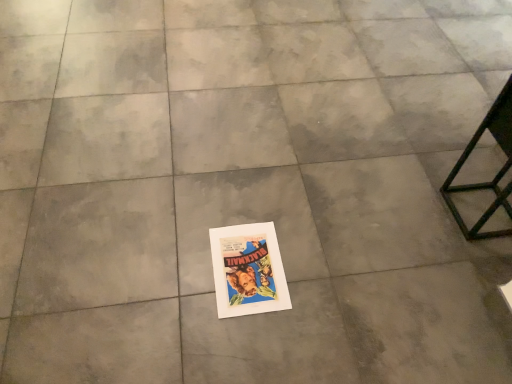
Question: Should I look upward or downward to see metallic black table at right?

Choices:
 (A) up
 (B) down

Answer: (A)

Question: Is metallic black table at right at the left side of vibrant paper poster at center?

Choices:
 (A) yes
 (B) no

Answer: (B)

Question: From a real-world perspective, is metallic black table at right under vibrant paper poster at center?

Choices:
 (A) no
 (B) yes

Answer: (A)

Question: Considering the relative sizes of metallic black table at right and vibrant paper poster at center in the image provided, is metallic black table at right shorter than vibrant paper poster at center?

Choices:
 (A) no
 (B) yes

Answer: (A)

Question: Is metallic black table at right bigger than vibrant paper poster at center?

Choices:
 (A) no
 (B) yes

Answer: (B)

Question: Is the depth of metallic black table at right less than that of vibrant paper poster at center?

Choices:
 (A) yes
 (B) no

Answer: (A)

Question: From the image's perspective, is metallic black table at right above vibrant paper poster at center?

Choices:
 (A) yes
 (B) no

Answer: (A)

Question: Is the depth of vibrant paper poster at center less than that of metallic black table at right?

Choices:
 (A) no
 (B) yes

Answer: (A)

Question: Does vibrant paper poster at center turn towards metallic black table at right?

Choices:
 (A) yes
 (B) no

Answer: (B)

Question: Is metallic black table at right surrounded by vibrant paper poster at center?

Choices:
 (A) no
 (B) yes

Answer: (A)

Question: Is vibrant paper poster at center turned away from metallic black table at right?

Choices:
 (A) no
 (B) yes

Answer: (A)

Question: From a real-world perspective, is vibrant paper poster at center under metallic black table at right?

Choices:
 (A) yes
 (B) no

Answer: (A)

Question: From the image's perspective, does vibrant paper poster at center appear lower than metallic black table at right?

Choices:
 (A) yes
 (B) no

Answer: (A)

Question: Considering the relative positions of vibrant paper poster at center and metallic black table at right in the image provided, is vibrant paper poster at center to the left or to the right of metallic black table at right?

Choices:
 (A) left
 (B) right

Answer: (A)